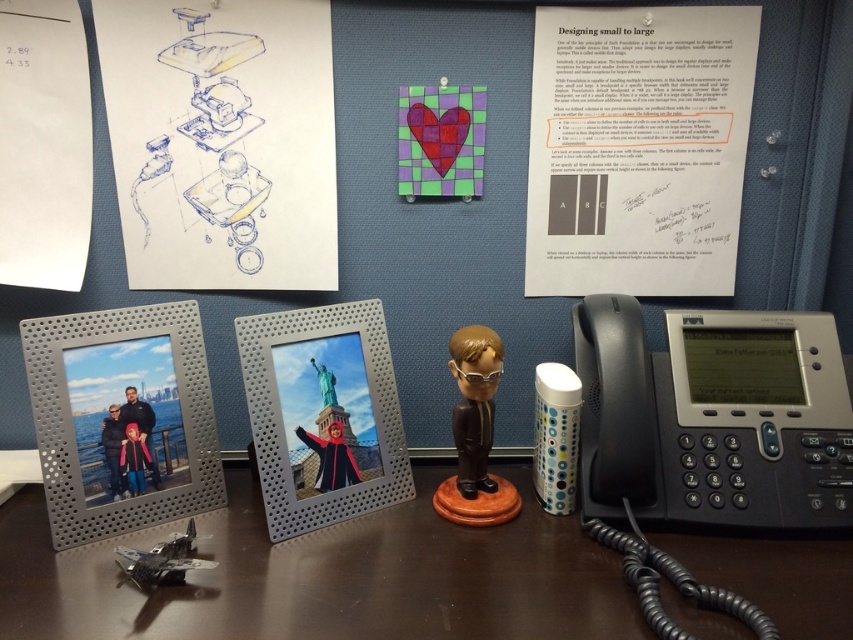
You are organizing items on a desk and need to place both the white paper at upper right and the shiny brown bobblehead at center. Since you want to ensure they both fit on the desk without overlapping, which object should you place first to accommodate the larger width?

The white paper at upper right should be placed first because it has a greater width than the shiny brown bobblehead at center, as stated in the description. This ensures there is enough space for it before placing the smaller item.

You need to place a rectangular object that is 12 inches wide on the desk. The brown wooden table at lower center and the white paper at upper right are both available. Which one can accommodate the object based on their widths?

The brown wooden table at lower center has a larger width than the white paper at upper right, so the rectangular object can be placed on the brown wooden table at lower center.

Where is the brown wooden table at lower center located in the image?

The brown wooden table at lower center is located at point (x=326, y=577) in the image.